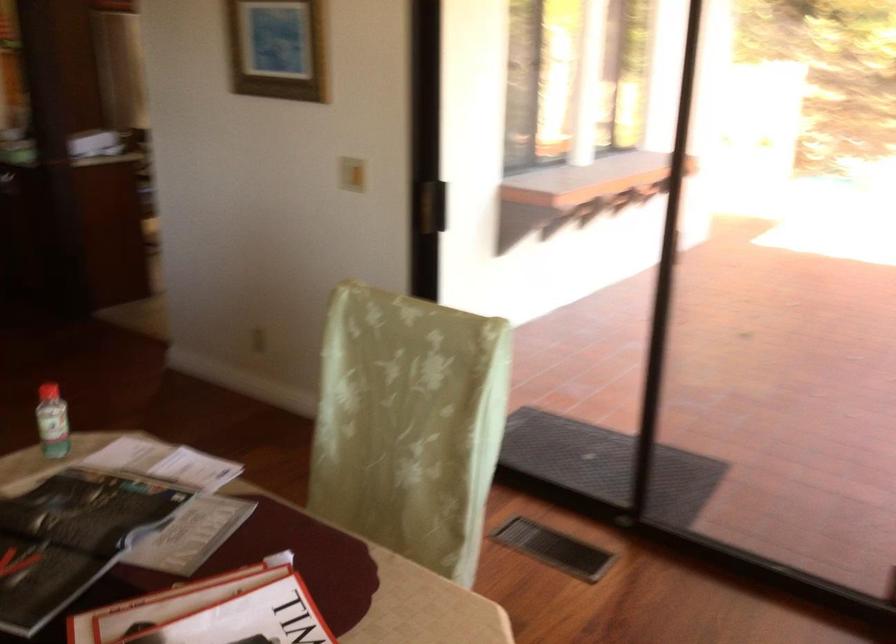
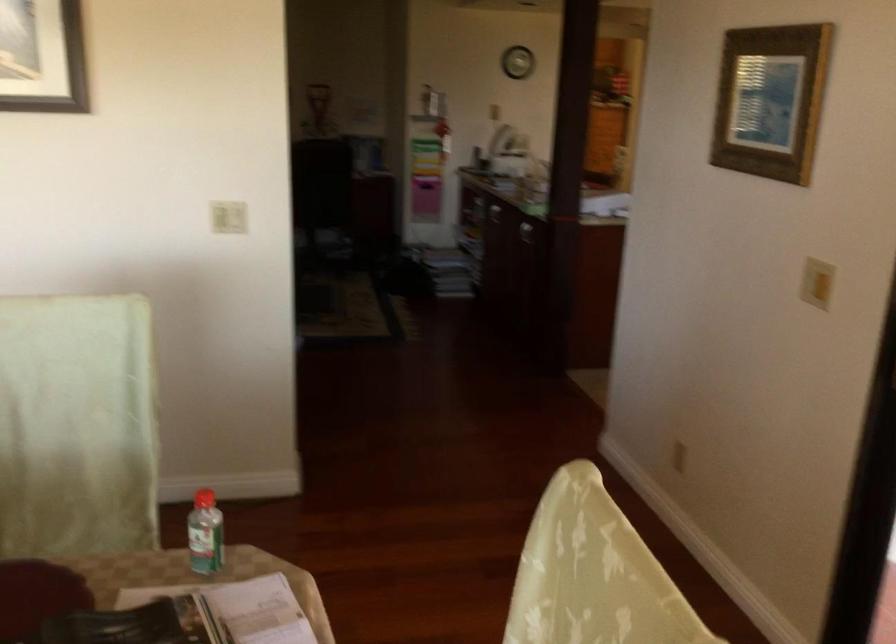
Question: The camera is either moving clockwise (left) or counter-clockwise (right) around the object. The first image is from the beginning of the video and the second image is from the end. Is the camera moving left or right when shooting the video?

Choices:
 (A) Left
 (B) Right

Answer: (B)